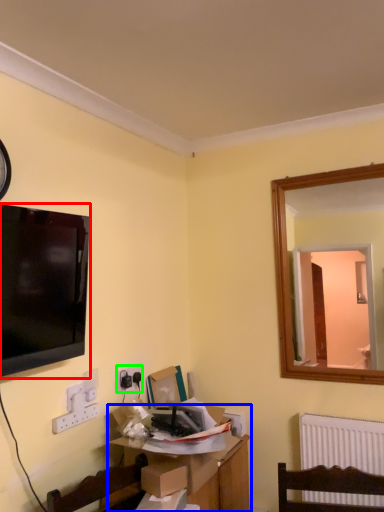
Question: Considering the real-world distances, which object is farthest from television (highlighted by a red box)? table (highlighted by a blue box) or electric outlet (highlighted by a green box)?

Choices:
 (A) table
 (B) electric outlet

Answer: (A)